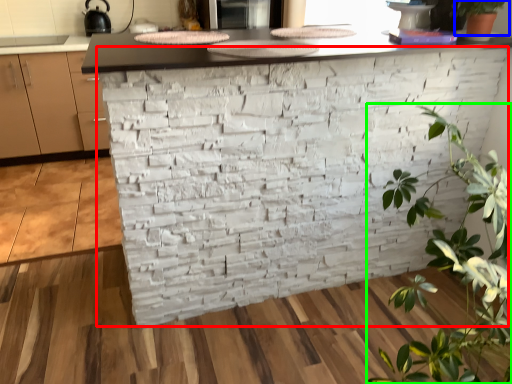
Question: Which object is positioned farthest from brickwork (highlighted by a red box)? Select from houseplant (highlighted by a blue box) and houseplant (highlighted by a green box).

Choices:
 (A) houseplant
 (B) houseplant

Answer: (A)